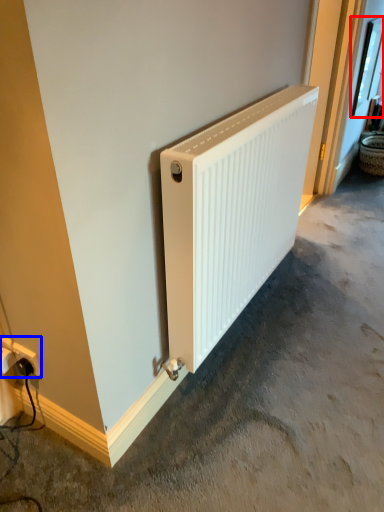
Question: Which of the following is the farthest to the observer, window (highlighted by a red box) or power plugs and sockets (highlighted by a blue box)?

Choices:
 (A) window
 (B) power plugs and sockets

Answer: (A)